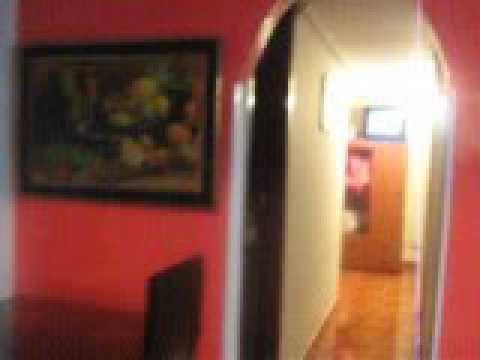
I want to click on hallway, so click(333, 288), click(373, 308), click(401, 258).